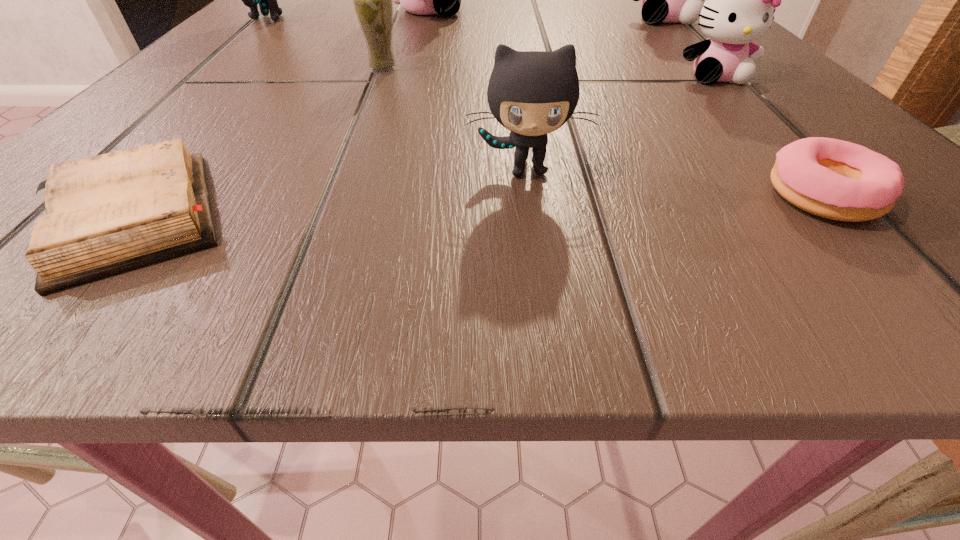
At what (x,y) coordinates should I click in order to perform the action: click on the second smallest white kitten. Please return your answer as a coordinate pair (x, y). The width and height of the screenshot is (960, 540). Looking at the image, I should click on (665, 0).

At what (x,y) coordinates should I click in order to perform the action: click on the bigger gray kitten. Please return your answer as a coordinate pair (x, y). Looking at the image, I should click on (267, 0).

The image size is (960, 540). What are the coordinates of `the leftmost kitten` in the screenshot? It's located at (267, 0).

Locate an element on the screen. The height and width of the screenshot is (540, 960). straw for drinking is located at coordinates (373, 0).

The height and width of the screenshot is (540, 960). Find the location of `the second nearest kitten`. the second nearest kitten is located at coordinates (740, 3).

Image resolution: width=960 pixels, height=540 pixels. Identify the location of the smallest white kitten. (740, 3).

This screenshot has width=960, height=540. I want to click on the nearer gray kitten, so click(x=532, y=93).

Image resolution: width=960 pixels, height=540 pixels. In order to click on the nearest kitten in this screenshot , I will do (x=532, y=93).

This screenshot has height=540, width=960. I want to click on the seventh tallest object, so click(x=834, y=179).

Locate an element on the screen. The width and height of the screenshot is (960, 540). doughnut is located at coordinates coord(834,179).